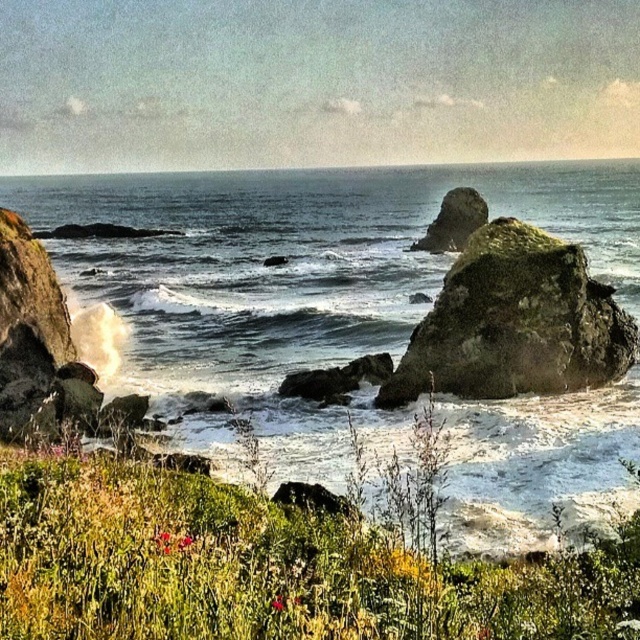
In the scene shown: Between green mossy rock at center-right and rough textured rock at center, which one is positioned higher?

Positioned higher is rough textured rock at center.

Who is more distant from viewer, [477,316] or [449,195]?

Point [449,195]

Find the location of a particular element. The width and height of the screenshot is (640, 640). green mossy rock at center-right is located at coordinates (515, 323).

Who is more distant from viewer, (348,212) or (465,205)?

Point (348,212)

Locate an element on the screen. clear blue water at center is located at coordinates (292, 280).

Identify the location of clear blue water at center. The image size is (640, 640). (292, 280).

Does clear blue water at center appear under green mossy rock at center-right?

No.

Who is lower down, clear blue water at center or green mossy rock at center-right?

Positioned lower is green mossy rock at center-right.

Who is more distant from viewer, (257, 280) or (556, 324)?

Point (257, 280)

This screenshot has height=640, width=640. In order to click on clear blue water at center in this screenshot , I will do `click(292, 280)`.